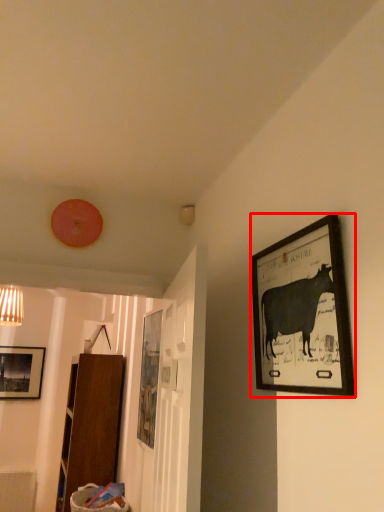
Question: From the image's perspective, considering the relative positions of picture frame (annotated by the red box) and picture frame in the image provided, where is picture frame (annotated by the red box) located with respect to the staircase?

Choices:
 (A) above
 (B) below

Answer: (A)